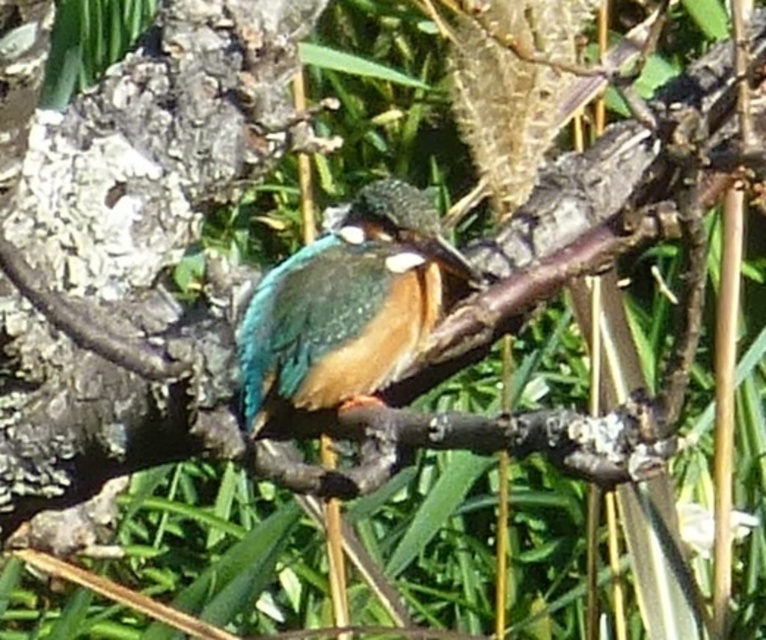
Looking at this image, is rough bark tree trunk at left smaller than shiny blue-green bird at center?

Incorrect, rough bark tree trunk at left is not smaller in size than shiny blue-green bird at center.

Who is shorter, rough bark tree trunk at left or shiny blue-green bird at center?

shiny blue-green bird at center

The height and width of the screenshot is (640, 766). I want to click on rough bark tree trunk at left, so click(156, 148).

Identify the location of rough bark tree trunk at left. (156, 148).